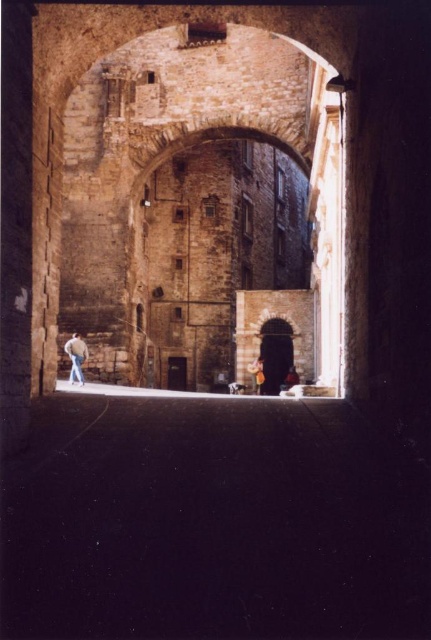
Question: Among these points, which one is nearest to the camera?

Choices:
 (A) (77, 369)
 (B) (372, 458)

Answer: (B)

Question: Is dark stone alley at center closer to the viewer compared to light brown leather jacket at left?

Choices:
 (A) yes
 (B) no

Answer: (A)

Question: In this image, where is dark stone alley at center located relative to light brown leather jacket at left?

Choices:
 (A) above
 (B) below

Answer: (B)

Question: Which point is farther to the camera?

Choices:
 (A) (74, 376)
 (B) (62, 406)

Answer: (A)

Question: Is dark stone alley at center to the right of light brown leather jacket at left from the viewer's perspective?

Choices:
 (A) no
 (B) yes

Answer: (B)